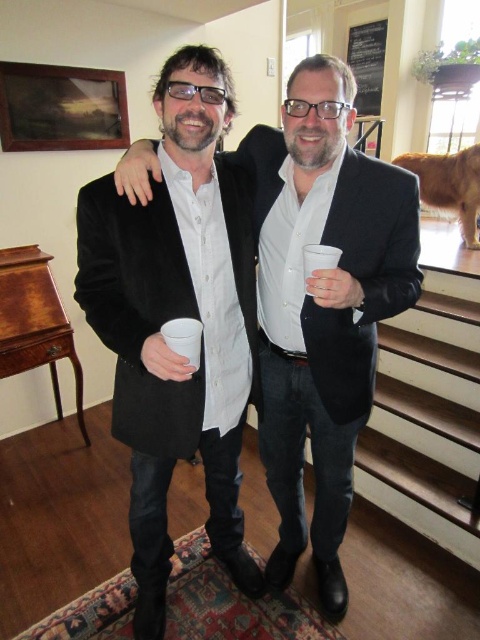
Question: Which is farther from the matte black coat at center?

Choices:
 (A) matte black suit at center
 (B) white styrofoam cup at center
 (C) white paper cup at center

Answer: (B)

Question: Does matte black coat at center have a larger size compared to white styrofoam cup at center?

Choices:
 (A) no
 (B) yes

Answer: (B)

Question: Which of the following is the closest to the observer?

Choices:
 (A) (308, 333)
 (B) (182, 355)
 (C) (313, 253)
 (D) (200, 228)

Answer: (B)

Question: Observing the image, what is the correct spatial positioning of matte black suit at center in reference to white paper cup at center?

Choices:
 (A) right
 (B) left

Answer: (A)

Question: Which of the following is the farthest from the observer?

Choices:
 (A) white styrofoam cup at center
 (B) white paper cup at center
 (C) matte black coat at center

Answer: (A)

Question: In this image, where is matte black suit at center located relative to white styrofoam cup at center?

Choices:
 (A) below
 (B) above

Answer: (A)